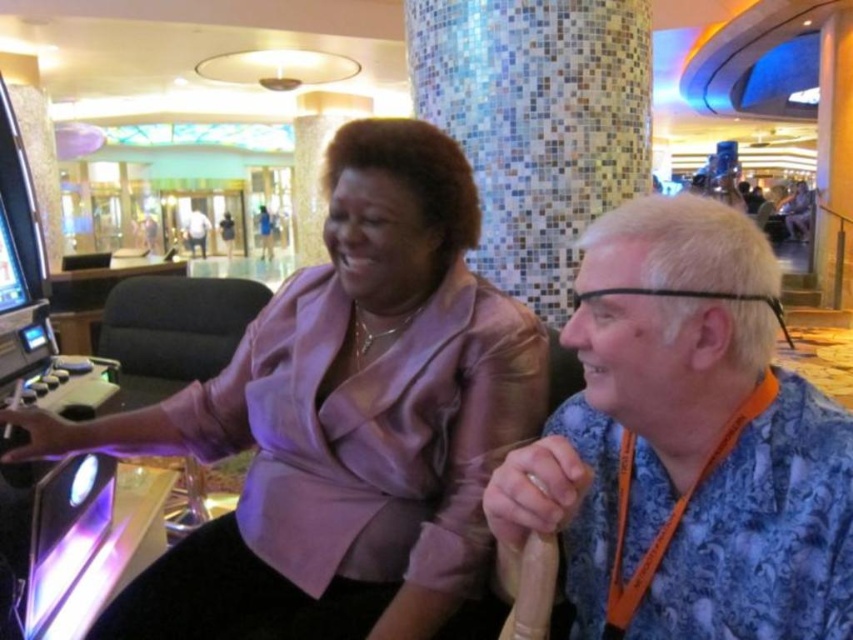
Does matte purple blouse at center have a lesser width compared to blue floral shirt at right?

Incorrect, matte purple blouse at center's width is not less than blue floral shirt at right's.

Between matte purple blouse at center and blue floral shirt at right, which one is positioned lower?

matte purple blouse at center is lower down.

This screenshot has width=853, height=640. Identify the location of matte purple blouse at center. (345, 422).